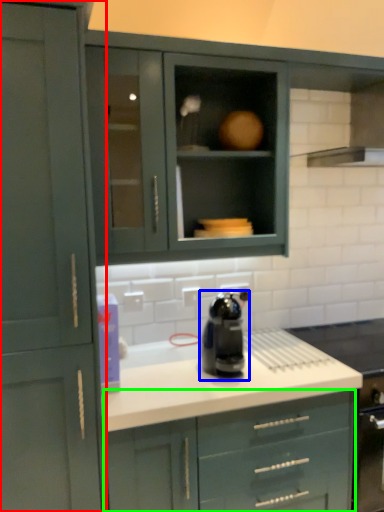
Question: Based on their relative distances, which object is farther from cabinetry (highlighted by a red box)? Choose from home appliance (highlighted by a blue box) and cabinetry (highlighted by a green box).

Choices:
 (A) home appliance
 (B) cabinetry

Answer: (A)